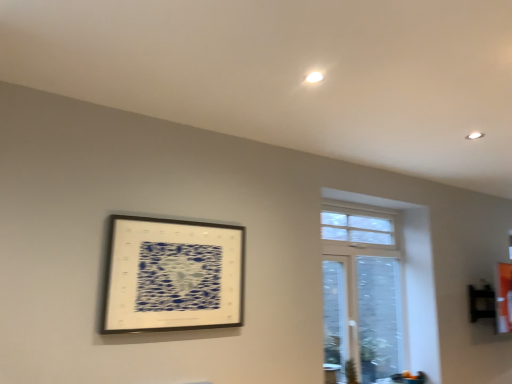
What is the approximate width of white glass window at upper right?

It is 5.42 inches.

Locate an element on the screen. white glass window at upper right is located at coordinates (383, 281).

What do you see at coordinates (383, 281) in the screenshot? The height and width of the screenshot is (384, 512). I see `white glass window at upper right` at bounding box center [383, 281].

What is the approximate width of metallic silver picture frame at upper left?

It is 4.17 centimeters.

The height and width of the screenshot is (384, 512). I want to click on metallic silver picture frame at upper left, so click(x=172, y=275).

What do you see at coordinates (172, 275) in the screenshot?
I see `metallic silver picture frame at upper left` at bounding box center [172, 275].

The height and width of the screenshot is (384, 512). Find the location of `white glass window at upper right`. white glass window at upper right is located at coordinates (383, 281).

Considering the positions of objects metallic silver picture frame at upper left and white glass window at upper right in the image provided, who is more to the right, metallic silver picture frame at upper left or white glass window at upper right?

Positioned to the right is white glass window at upper right.

Between metallic silver picture frame at upper left and white glass window at upper right, which one is positioned behind?

white glass window at upper right is more distant.

Between point (232, 296) and point (367, 350), which one is positioned behind?

The point (367, 350) is farther.

From the image's perspective, is metallic silver picture frame at upper left located above or below white glass window at upper right?

Clearly, from the image's perspective, metallic silver picture frame at upper left is above white glass window at upper right.

From a real-world perspective, which object stands above the other?

metallic silver picture frame at upper left, from a real-world perspective.

Which object is thinner, metallic silver picture frame at upper left or white glass window at upper right?

metallic silver picture frame at upper left.

Is metallic silver picture frame at upper left shorter than white glass window at upper right?

Indeed, metallic silver picture frame at upper left has a lesser height compared to white glass window at upper right.

Between metallic silver picture frame at upper left and white glass window at upper right, which one has smaller size?

With smaller size is metallic silver picture frame at upper left.

Is metallic silver picture frame at upper left situated inside white glass window at upper right or outside?

metallic silver picture frame at upper left is not inside white glass window at upper right, it's outside.

Is the surface of metallic silver picture frame at upper left in direct contact with white glass window at upper right?

There is a gap between metallic silver picture frame at upper left and white glass window at upper right.

Is metallic silver picture frame at upper left looking in the opposite direction of white glass window at upper right?

No.

What's the angular difference between metallic silver picture frame at upper left and white glass window at upper right's facing directions?

The angular difference between metallic silver picture frame at upper left and white glass window at upper right is 0.279 degrees.

Identify the location of window below the metallic silver picture frame at upper left (from the image's perspective). The height and width of the screenshot is (384, 512). (383, 281).

Which object is positioned more to the right, white glass window at upper right or metallic silver picture frame at upper left?

Positioned to the right is white glass window at upper right.

Does white glass window at upper right come behind metallic silver picture frame at upper left?

Yes, it is.

Is point (420, 291) closer or farther from the camera than point (206, 231)?

Clearly, point (420, 291) is more distant from the camera than point (206, 231).

From the image's perspective, which object appears higher, white glass window at upper right or metallic silver picture frame at upper left?

metallic silver picture frame at upper left is shown above in the image.

From a real-world perspective, is white glass window at upper right physically located above or below metallic silver picture frame at upper left?

white glass window at upper right is below metallic silver picture frame at upper left.

Considering the relative sizes of white glass window at upper right and metallic silver picture frame at upper left in the image provided, is white glass window at upper right wider than metallic silver picture frame at upper left?

Correct, the width of white glass window at upper right exceeds that of metallic silver picture frame at upper left.

Which of these two, white glass window at upper right or metallic silver picture frame at upper left, stands taller?

With more height is white glass window at upper right.

Is white glass window at upper right bigger or smaller than metallic silver picture frame at upper left?

In the image, white glass window at upper right appears to be larger than metallic silver picture frame at upper left.

Could metallic silver picture frame at upper left be considered to be inside white glass window at upper right?

No, metallic silver picture frame at upper left is not a part of white glass window at upper right.

Would you say white glass window at upper right is a long distance from metallic silver picture frame at upper left?

Yes, white glass window at upper right and metallic silver picture frame at upper left are quite far apart.

Is metallic silver picture frame at upper left at the back of white glass window at upper right?

That's not correct — white glass window at upper right is not looking away from metallic silver picture frame at upper left.

Measure the distance from white glass window at upper right to metallic silver picture frame at upper left.

A distance of 1.37 meters exists between white glass window at upper right and metallic silver picture frame at upper left.

The image size is (512, 384). In order to click on window behind the metallic silver picture frame at upper left in this screenshot , I will do `click(383, 281)`.

At what (x,y) coordinates should I click in order to perform the action: click on window behind the metallic silver picture frame at upper left. Please return your answer as a coordinate pair (x, y). Looking at the image, I should click on (383, 281).

The width and height of the screenshot is (512, 384). In order to click on picture frame on the left of white glass window at upper right in this screenshot , I will do `click(172, 275)`.